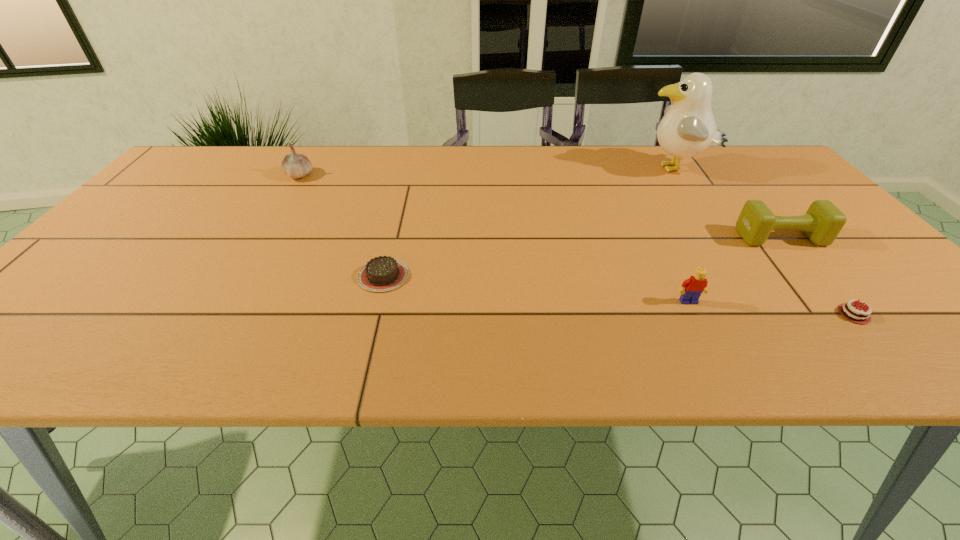
At what (x,y) coordinates should I click in order to perform the action: click on gull. Please return your answer as a coordinate pair (x, y). Image resolution: width=960 pixels, height=540 pixels. Looking at the image, I should click on (688, 128).

Locate an element on the screen. This screenshot has height=540, width=960. garlic is located at coordinates (296, 166).

Identify the location of Lego. The height and width of the screenshot is (540, 960). (x=695, y=285).

Find the location of `the fourth nearest object`. the fourth nearest object is located at coordinates (823, 221).

Locate an element on the screen. the left chocolate cake is located at coordinates (382, 273).

At what (x,y) coordinates should I click in order to perform the action: click on the right chocolate cake. Please return your answer as a coordinate pair (x, y). The height and width of the screenshot is (540, 960). Looking at the image, I should click on (849, 311).

The height and width of the screenshot is (540, 960). What are the coordinates of `vacant area situated 0.310m on the beak of the gull` in the screenshot? It's located at (534, 170).

Identify the location of free space located 0.050m on the beak of the gull. Image resolution: width=960 pixels, height=540 pixels. (621, 170).

At what (x,y) coordinates should I click in order to perform the action: click on vacant space located 0.150m on the beak of the gull. Please return your answer as a coordinate pair (x, y). Looking at the image, I should click on (588, 170).

Find the location of `free space located on the left of the garlic`. free space located on the left of the garlic is located at coordinates (173, 175).